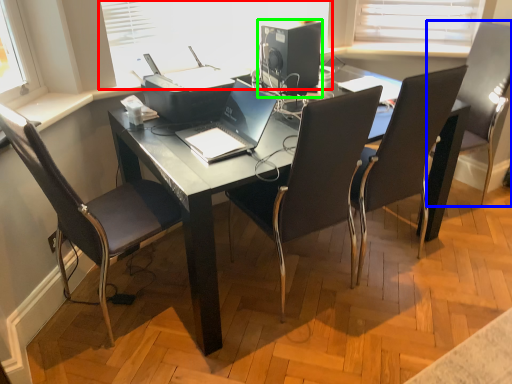
Question: Based on their relative distances, which object is farther from window screen (highlighted by a red box)? Choose from chair (highlighted by a blue box) and desktop computer (highlighted by a green box).

Choices:
 (A) chair
 (B) desktop computer

Answer: (A)